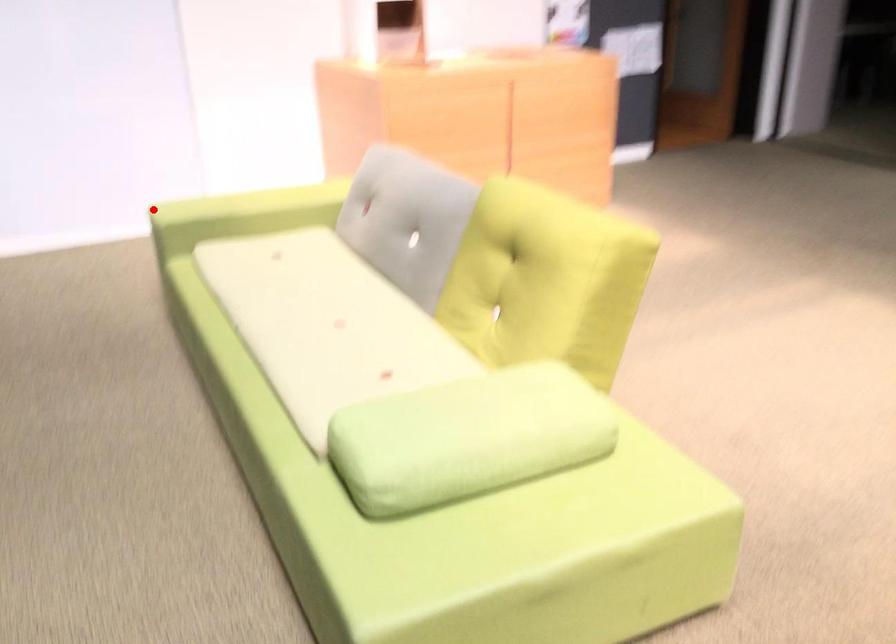
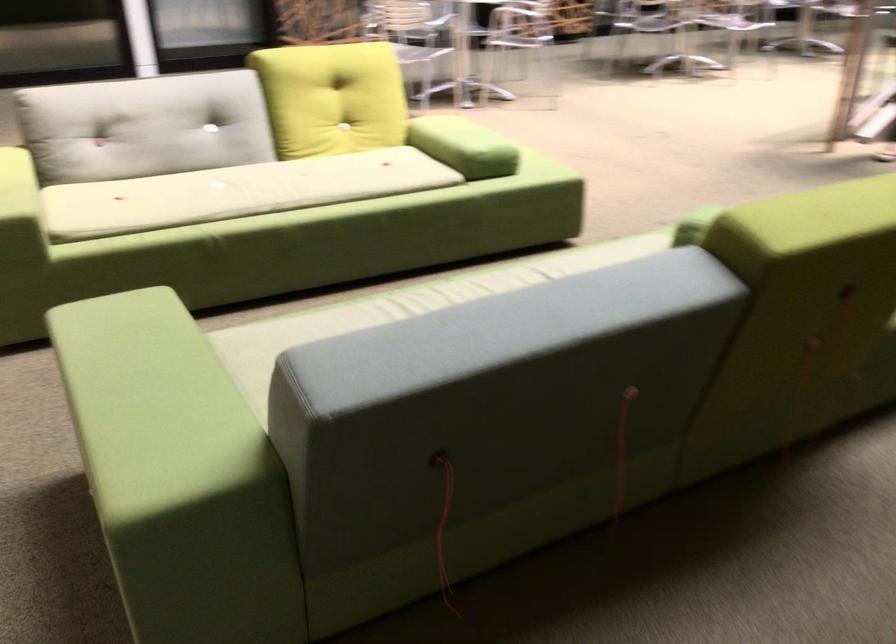
Locate, in the second image, the point that corresponds to the highlighted location in the first image.

(19, 207)